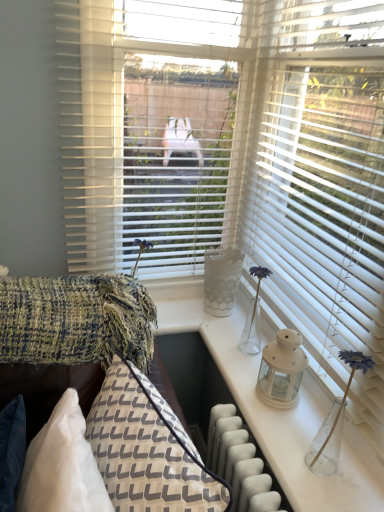
Question: Can you confirm if textured woven couch at lower left is wider than white matte blinds at right?

Choices:
 (A) no
 (B) yes

Answer: (B)

Question: Considering the relative sizes of textured woven couch at lower left and white matte blinds at right in the image provided, is textured woven couch at lower left bigger than white matte blinds at right?

Choices:
 (A) no
 (B) yes

Answer: (B)

Question: Is textured woven couch at lower left with white matte blinds at right?

Choices:
 (A) no
 (B) yes

Answer: (A)

Question: Can you confirm if textured woven couch at lower left is positioned to the right of white matte blinds at right?

Choices:
 (A) yes
 (B) no

Answer: (B)

Question: Can you confirm if textured woven couch at lower left is positioned to the left of white matte blinds at right?

Choices:
 (A) yes
 (B) no

Answer: (A)

Question: Is textured woven couch at lower left facing away from white matte blinds at right?

Choices:
 (A) yes
 (B) no

Answer: (B)

Question: Can you confirm if textured woven pillow at lower left is shorter than textured woolen blanket at left?

Choices:
 (A) no
 (B) yes

Answer: (A)

Question: From a real-world perspective, does textured woven pillow at lower left sit lower than textured woolen blanket at left?

Choices:
 (A) no
 (B) yes

Answer: (B)

Question: Does textured woven pillow at lower left have a greater height compared to textured woolen blanket at left?

Choices:
 (A) no
 (B) yes

Answer: (B)

Question: Does textured woven pillow at lower left have a greater width compared to textured woolen blanket at left?

Choices:
 (A) yes
 (B) no

Answer: (B)

Question: Can textured woolen blanket at left be found inside textured woven pillow at lower left?

Choices:
 (A) no
 (B) yes

Answer: (A)

Question: Is textured woven pillow at lower left at the right side of textured woolen blanket at left?

Choices:
 (A) yes
 (B) no

Answer: (A)

Question: Considering the relative sizes of textured woolen blanket at left and matte white lantern at right in the image provided, is textured woolen blanket at left shorter than matte white lantern at right?

Choices:
 (A) no
 (B) yes

Answer: (B)